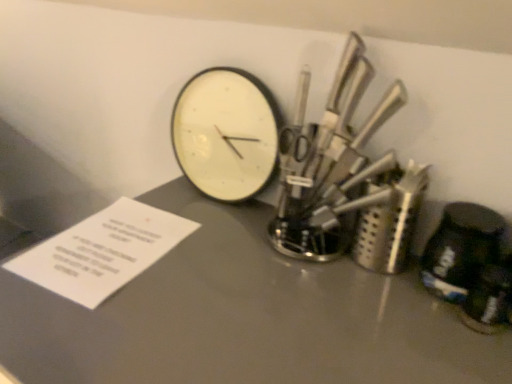
Identify the location of free space in front of white paper at lower left. (103, 331).